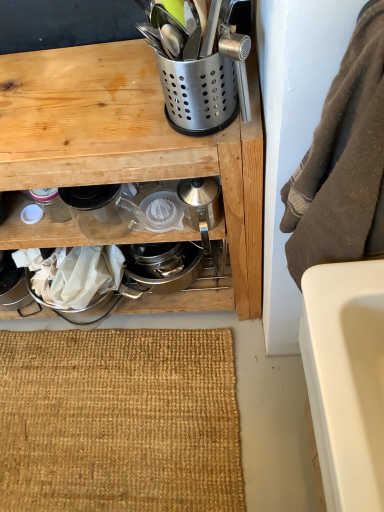
The image size is (384, 512). Find the location of `blank space to the left of satin silver utensil holder at upper center, marked as the 2th appliance in a right-to-left arrangement`. blank space to the left of satin silver utensil holder at upper center, marked as the 2th appliance in a right-to-left arrangement is located at coordinates (113, 117).